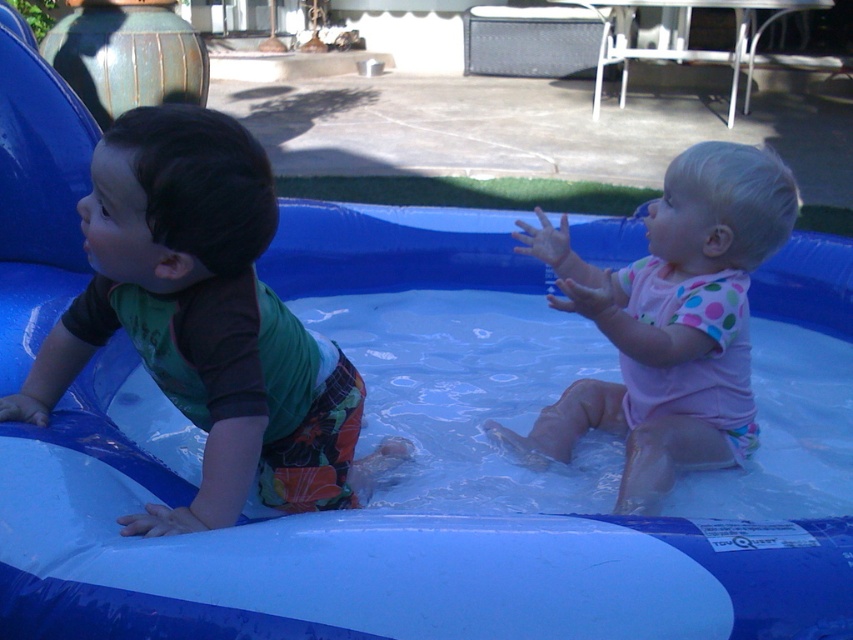
Between green fabric shirt at left and pink polka dot swimsuit at center, which one is positioned lower?

green fabric shirt at left is lower down.

Is green fabric shirt at left to the left of pink polka dot swimsuit at center from the viewer's perspective?

Yes, green fabric shirt at left is to the left of pink polka dot swimsuit at center.

I want to click on green fabric shirt at left, so click(x=206, y=323).

I want to click on green fabric shirt at left, so click(x=206, y=323).

Which is below, blue rubber pool at center or pink polka dot swimsuit at center?

blue rubber pool at center is lower down.

Between blue rubber pool at center and pink polka dot swimsuit at center, which one has less height?

With less height is blue rubber pool at center.

Which is behind, point (773, 618) or point (753, 218)?

The point (753, 218) is more distant.

Locate an element on the screen. The width and height of the screenshot is (853, 640). blue rubber pool at center is located at coordinates (370, 557).

Is blue rubber pool at center shorter than green fabric shirt at left?

No.

Between blue rubber pool at center and green fabric shirt at left, which one has more height?

blue rubber pool at center is taller.

Which is behind, point (244, 620) or point (338, 404)?

The point (338, 404) is more distant.

Where is `blue rubber pool at center`? This screenshot has height=640, width=853. blue rubber pool at center is located at coordinates (370, 557).